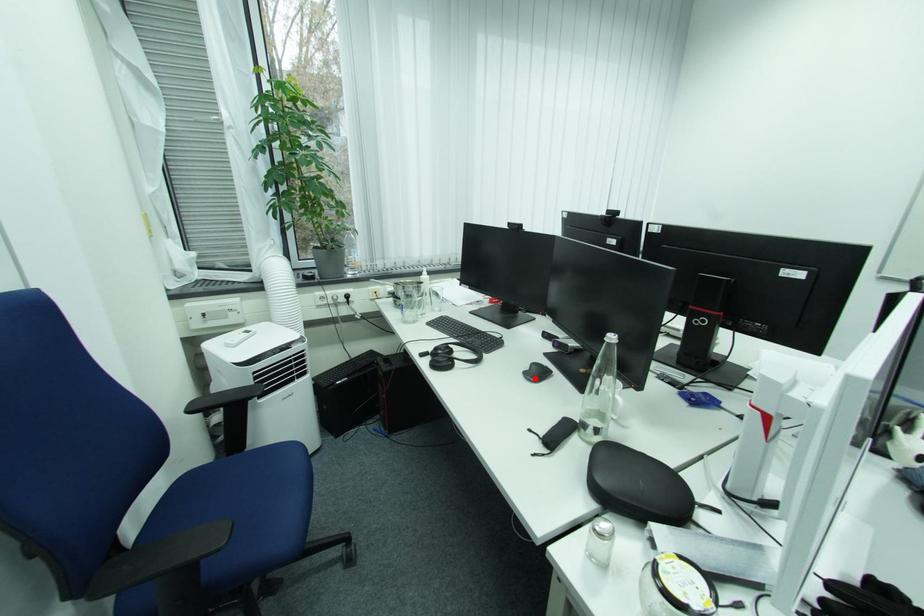
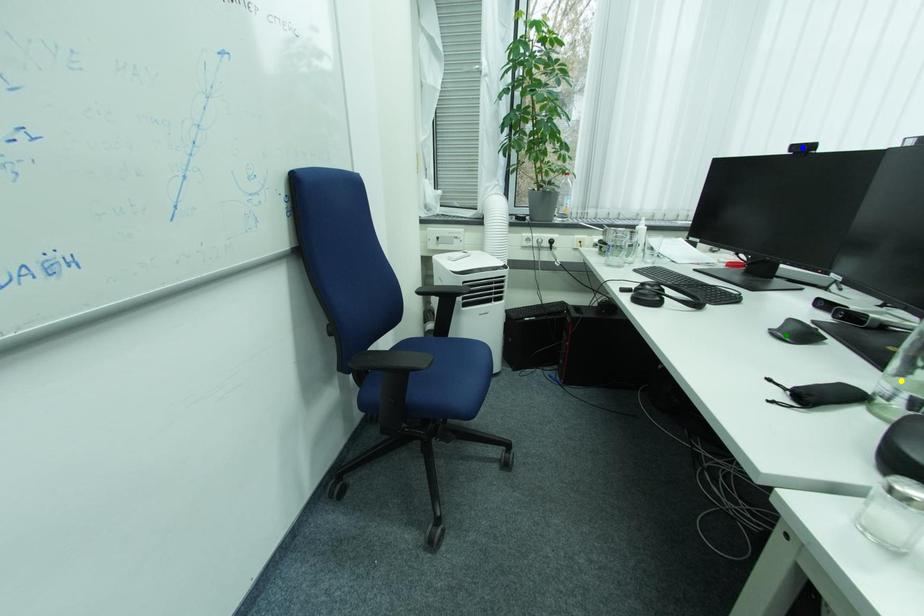
Question: I am providing you with two images of the same scene from different viewpoints. A red point is marked on the first image. You are given multiple points on the second image. In image 2, which mark is for the same physical point as the one in image 1?

Choices:
 (A) blue point
 (B) green point
 (C) yellow point

Answer: (B)